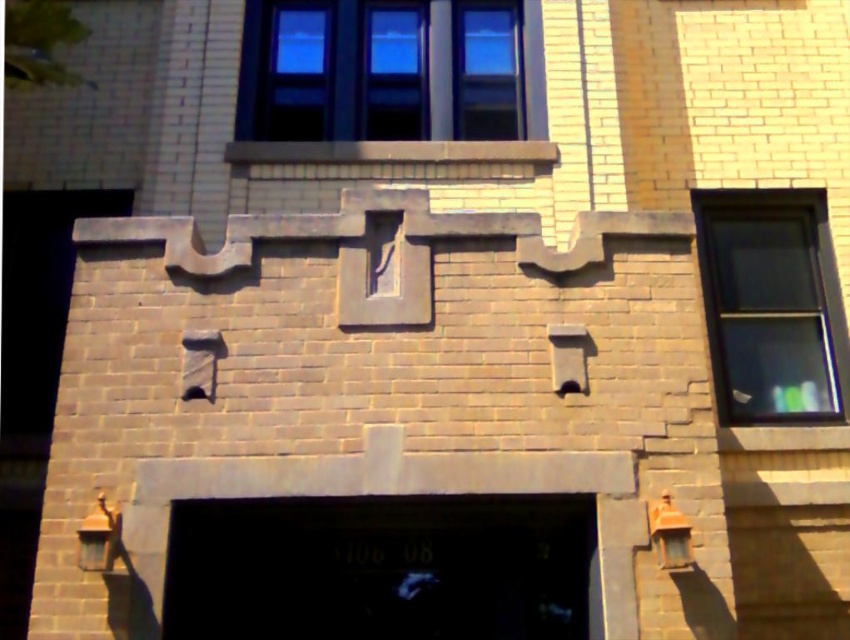
You are standing in front of the building and want to enter through the entrance. Which object should you approach first, the black glass door at center or the clear glass window at right?

The black glass door at center is closer to the viewer than the clear glass window at right, so you should approach the black glass door at center first to enter.

You are standing in front of the building and want to enter through the entrance. Which object should you approach first, the black glass door at center or the clear glass window at upper center?

The black glass door at center is located below the clear glass window at upper center, so you should approach the black glass door at center first to enter the building.